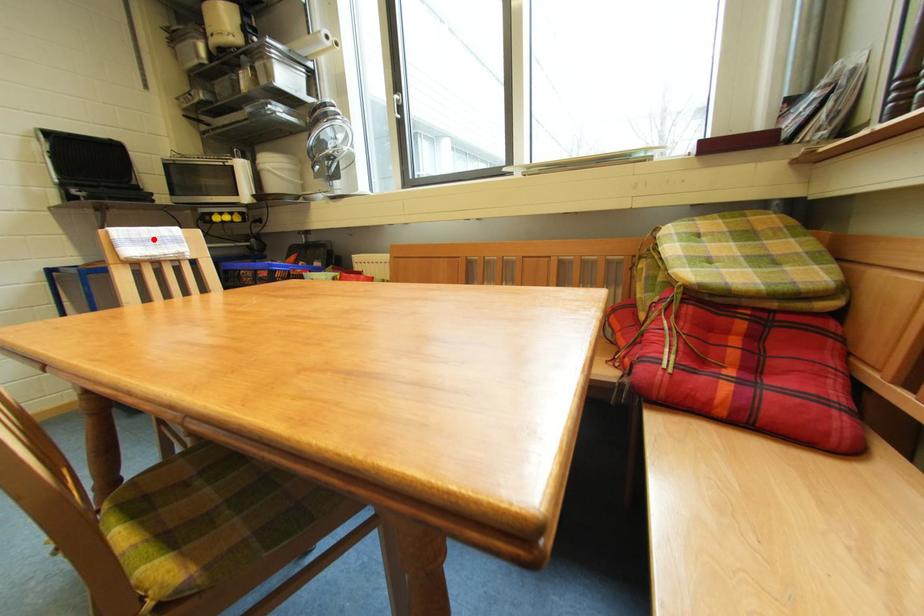
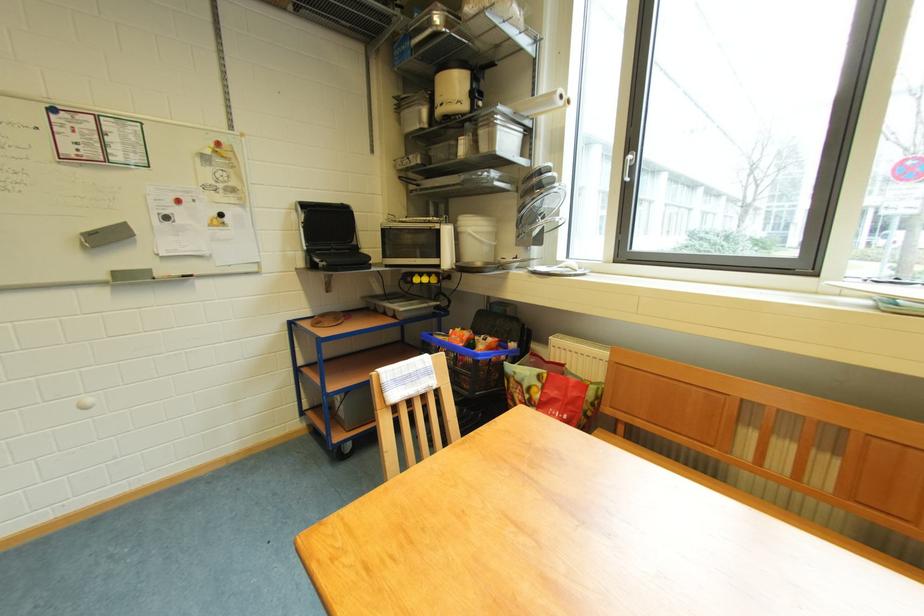
Where in the second image is the point corresponding to the highlighted location from the first image?

(412, 376)